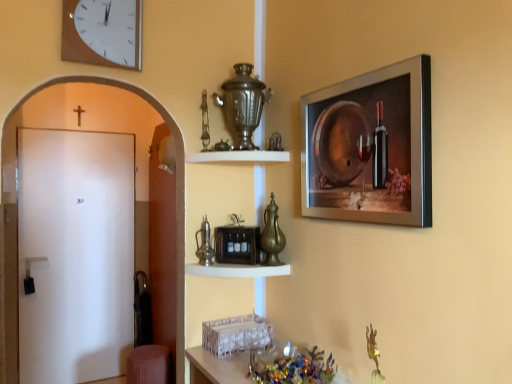
This screenshot has height=384, width=512. Find the location of `vacant space situated on the left part of wooden clock at upper left`. vacant space situated on the left part of wooden clock at upper left is located at coordinates (68, 72).